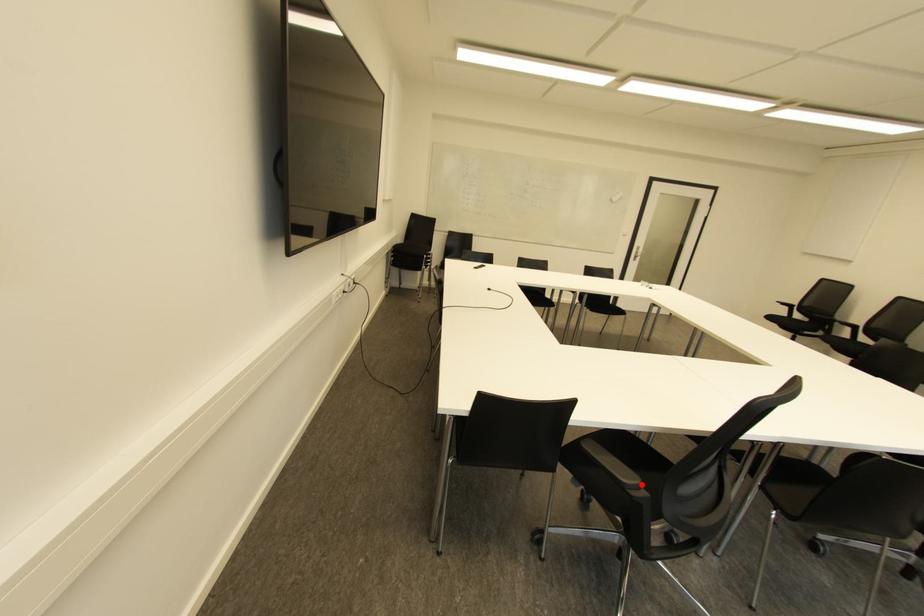
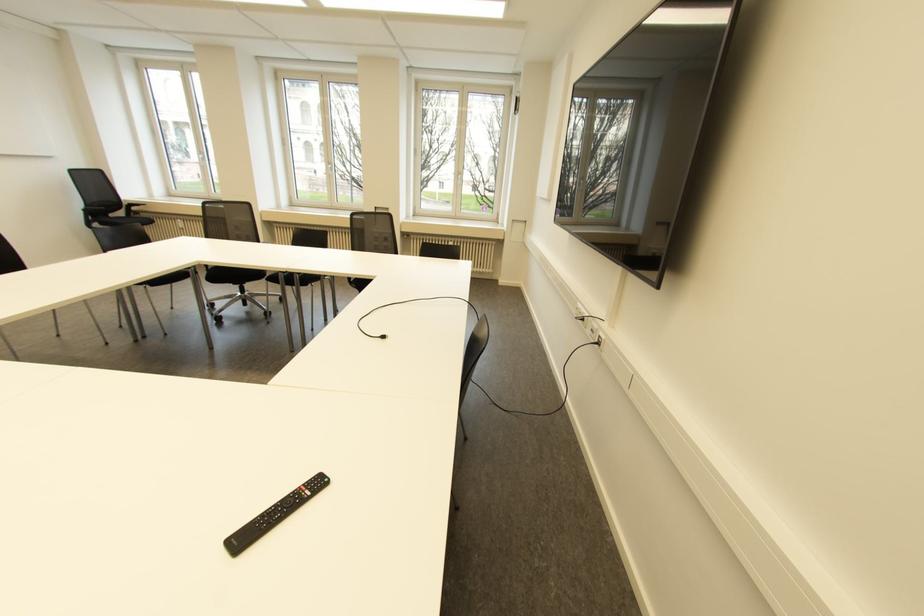
Question: I am providing you with two images of the same scene from different viewpoints. A red point is marked on the first image. Is the red point's position out of view in image 2?

Choices:
 (A) Yes
 (B) No

Answer: (A)